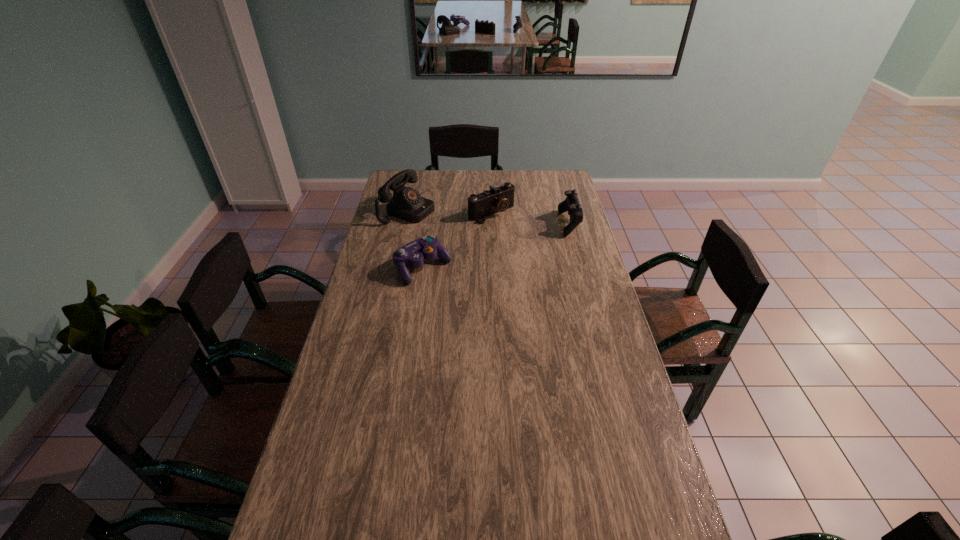
You are a GUI agent. You are given a task and a screenshot of the screen. Output one action in this format:
    pyautogui.click(x=<x>, y=<y>)
    Task: Click on the vacant space in between the farther control and the third object from left to right
    
    Given the screenshot: What is the action you would take?
    pyautogui.click(x=531, y=218)

Where is `object that is the closest to the telephone`? object that is the closest to the telephone is located at coordinates (498, 199).

Where is `object that can be found as the third closest to the second object from right to left`? Image resolution: width=960 pixels, height=540 pixels. object that can be found as the third closest to the second object from right to left is located at coordinates (412, 254).

I want to click on vacant position in the image that satisfies the following two spatial constraints: 1. on the front side of the tallest object; 2. on the right side of the left control, so click(x=396, y=268).

Where is `vacant region that satisfies the following two spatial constraints: 1. on the front side of the camera; 2. on the left side of the tallest object`? vacant region that satisfies the following two spatial constraints: 1. on the front side of the camera; 2. on the left side of the tallest object is located at coordinates (407, 213).

Locate an element on the screen. The width and height of the screenshot is (960, 540). free space that satisfies the following two spatial constraints: 1. on the front side of the second object from right to left; 2. on the surface of the right control with buttons is located at coordinates (492, 224).

Where is `vacant area in the image that satisfies the following two spatial constraints: 1. on the front side of the tallest object; 2. on the surface of the right control with buttons`? This screenshot has height=540, width=960. vacant area in the image that satisfies the following two spatial constraints: 1. on the front side of the tallest object; 2. on the surface of the right control with buttons is located at coordinates (405, 224).